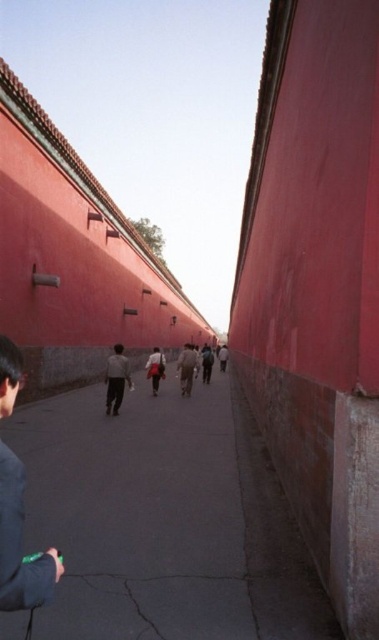
Question: Estimate the real-world distances between objects in this image. Which object is closer to the concrete pavement at center?

Choices:
 (A) light gray fabric jacket at center
 (B) dark brown leather jacket at center

Answer: (A)

Question: Can you confirm if light gray fabric jacket at center is thinner than dark brown leather jacket at center?

Choices:
 (A) yes
 (B) no

Answer: (B)

Question: Is concrete pavement at center below light brown fabric jacket at center?

Choices:
 (A) yes
 (B) no

Answer: (B)

Question: Which point is closer to the camera taking this photo?

Choices:
 (A) (178, 360)
 (B) (123, 349)

Answer: (B)

Question: Which object is farther from the camera taking this photo?

Choices:
 (A) light gray fabric jacket at center
 (B) dark brown leather jacket at center

Answer: (B)

Question: Is concrete pavement at center further to camera compared to light brown fabric jacket at center?

Choices:
 (A) yes
 (B) no

Answer: (B)